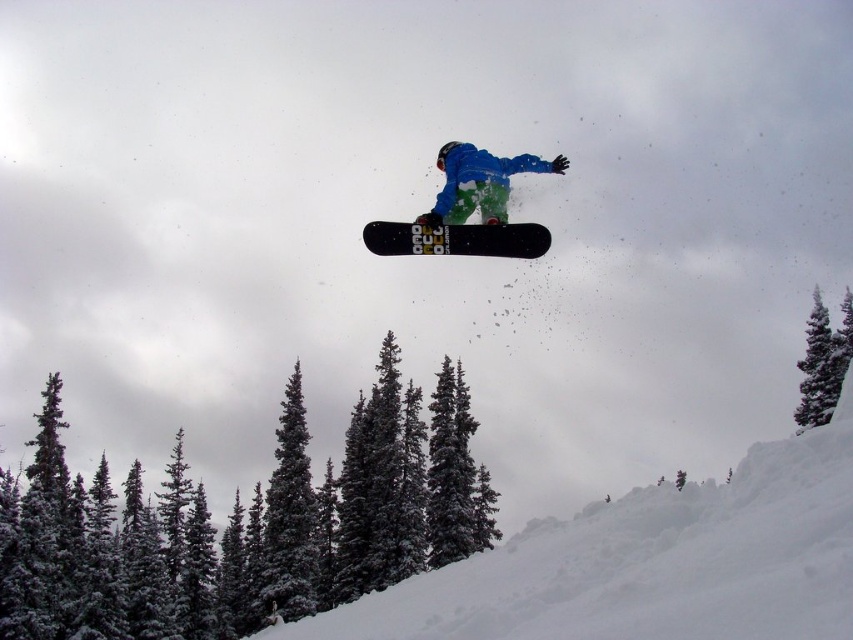
Who is lower down, black matte snowboard at center or green textured pine tree at center?

green textured pine tree at center

Between black matte snowboard at center and green textured pine tree at center, which one appears on the right side from the viewer's perspective?

A: green textured pine tree at center is more to the right.

What do you see at coordinates (457, 240) in the screenshot? The image size is (853, 640). I see `black matte snowboard at center` at bounding box center [457, 240].

Identify the location of black matte snowboard at center. This screenshot has height=640, width=853. (457, 240).

Who is lower down, snowy evergreen trees at lower left or matte black snowboard at center?

snowy evergreen trees at lower left is below.

Looking at this image, which of these two, snowy evergreen trees at lower left or matte black snowboard at center, stands taller?

Standing taller between the two is snowy evergreen trees at lower left.

What do you see at coordinates (244, 524) in the screenshot? I see `snowy evergreen trees at lower left` at bounding box center [244, 524].

What are the coordinates of `snowy evergreen trees at lower left` in the screenshot? It's located at (244, 524).

Does snowy evergreen trees at lower left appear under black matte snowboard at center?

Yes.

This screenshot has height=640, width=853. Describe the element at coordinates (244, 524) in the screenshot. I see `snowy evergreen trees at lower left` at that location.

Locate an element on the screen. The width and height of the screenshot is (853, 640). snowy evergreen trees at lower left is located at coordinates (244, 524).